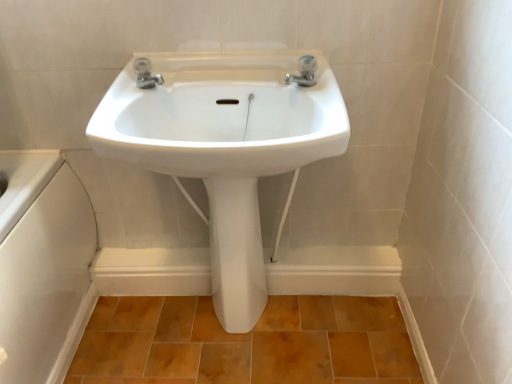
Where is `free location to the left of white glossy pedestal at center`? The width and height of the screenshot is (512, 384). free location to the left of white glossy pedestal at center is located at coordinates (182, 328).